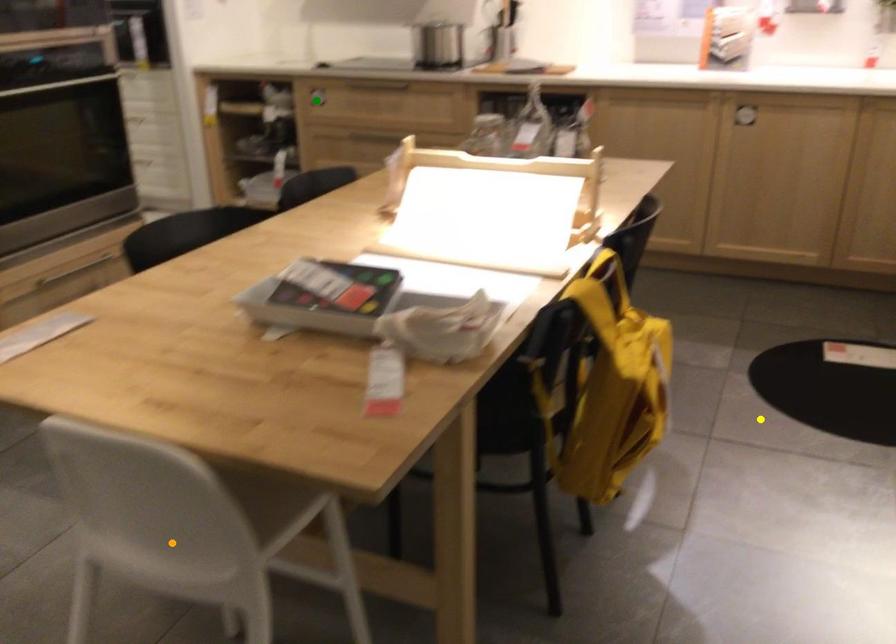
Order these from nearest to farthest:
- yellow point
- green point
- orange point

1. orange point
2. yellow point
3. green point